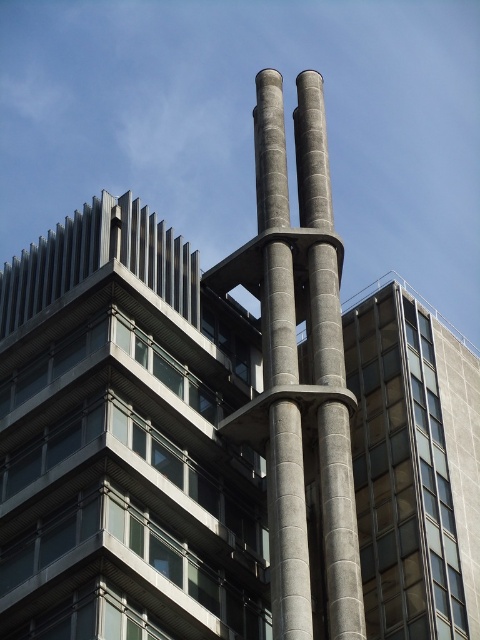
Between point (323, 442) and point (294, 326), which one is positioned in front?

Point (323, 442) is in front.

At what (x,y) coordinates should I click in order to perform the action: click on gray concrete pillar at center. Please return your answer as a coordinate pair (x, y). The width and height of the screenshot is (480, 640). Looking at the image, I should click on (298, 369).

The height and width of the screenshot is (640, 480). What do you see at coordinates (298, 369) in the screenshot?
I see `gray concrete pillar at center` at bounding box center [298, 369].

Where is `gray concrete pillar at center`? This screenshot has height=640, width=480. gray concrete pillar at center is located at coordinates (298, 369).

Is point (289, 580) farther from camera compared to point (328, 406)?

No, (289, 580) is closer to viewer.

Does gray concrete pillars at center appear over slate gray concrete pillar at center?

Yes, gray concrete pillars at center is above slate gray concrete pillar at center.

Which is in front, point (285, 241) or point (296, 157)?

Point (285, 241) is more forward.

Identify the location of gray concrete pillars at center. pyautogui.click(x=288, y=522).

Between gray concrete pillar at center and slate gray concrete pillar at center, which one is positioned lower?

Positioned lower is gray concrete pillar at center.

Who is more forward, (322, 314) or (311, 144)?

Point (322, 314) is more forward.

The image size is (480, 640). I want to click on gray concrete pillar at center, so click(298, 369).